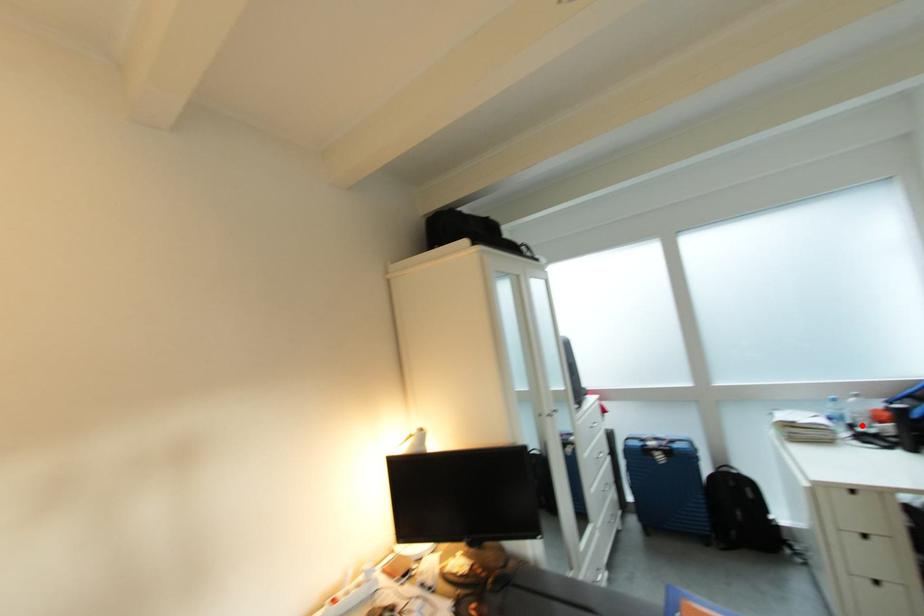
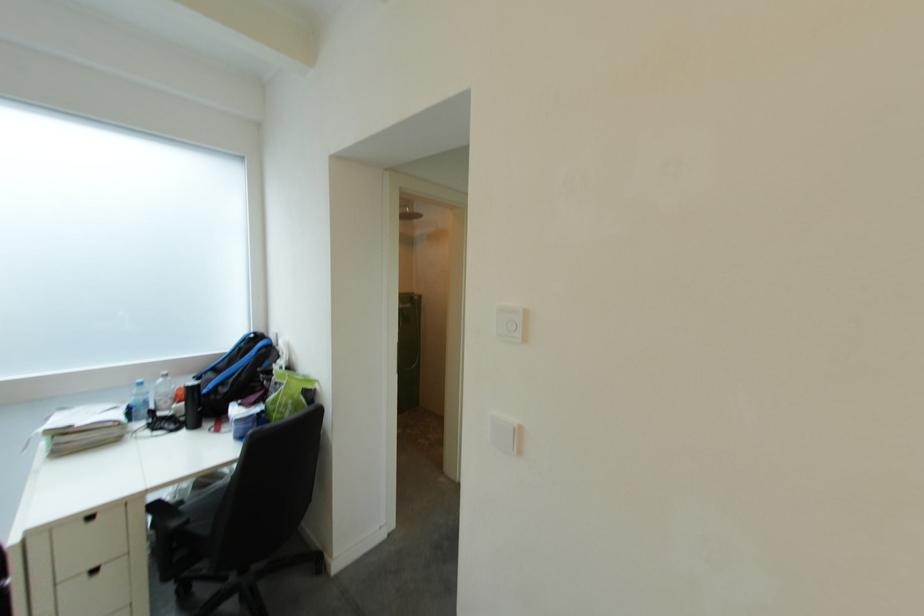
Question: I am providing you with two images of the same scene from different viewpoints. A red point is marked on the first image. Can you still see the location of the red point in image 2?

Choices:
 (A) Yes
 (B) No

Answer: (A)